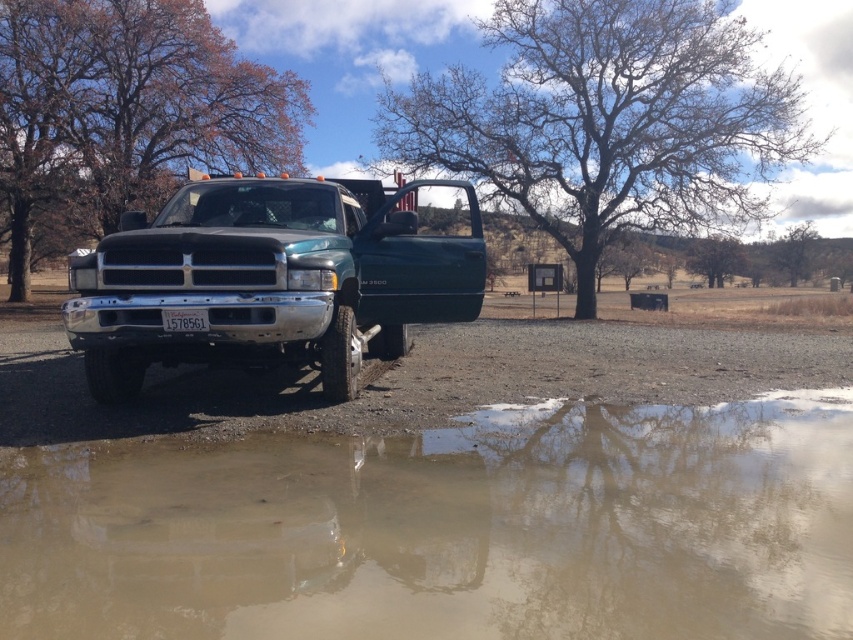
You are a delivery driver who needs to park your truck on the gravel surface near the brown muddy water at lower center and the bare branches tree at upper center. Considering the space between them, will your truck fit without touching either object?

The brown muddy water at lower center is narrower than the bare branches tree at upper center. Since the truck needs space between them, it might fit, but the exact dimensions aren

You are standing near the open door of the dark green Dodge Ram 2500 pickup truck. You want to walk towards the green leafy tree at center. Which direction should you turn to avoid stepping into the brown muddy water at lower center?

To avoid stepping into the brown muddy water at lower center, you should turn to the right when walking towards the green leafy tree at center, since the brown muddy water is located to the left of the tree.